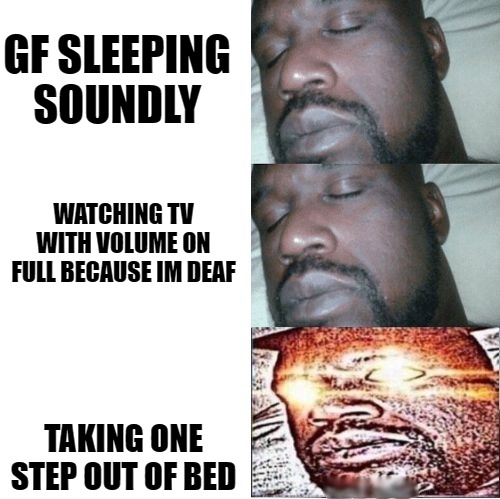
Find the location of `picture`. picture is located at coordinates (356, 436), (370, 290), (365, 67).